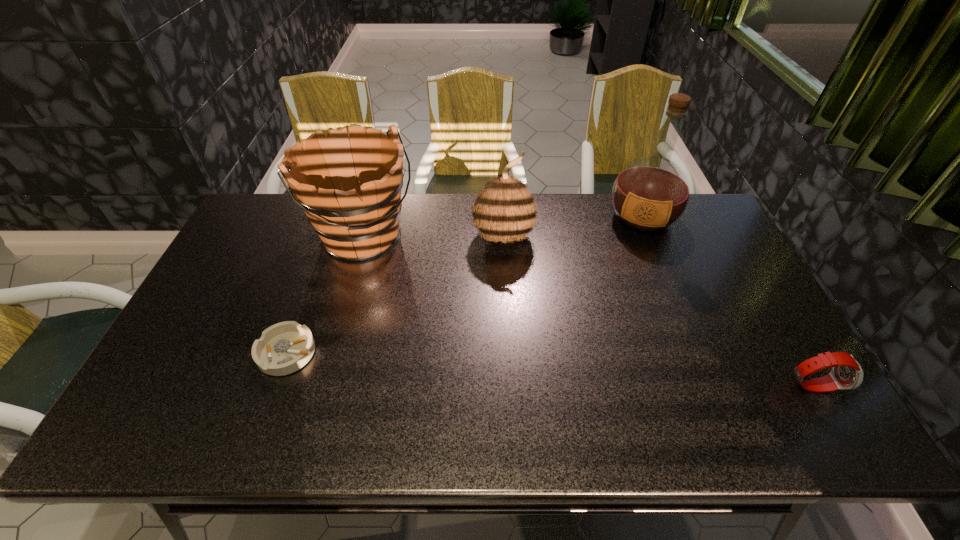
Locate an element on the screen. This screenshot has height=540, width=960. free space at the near left corner of the desktop is located at coordinates (168, 379).

Where is `free space at the far right corner of the desktop`? free space at the far right corner of the desktop is located at coordinates (695, 211).

Where is `free space between the wine bucket and the coconut`? The width and height of the screenshot is (960, 540). free space between the wine bucket and the coconut is located at coordinates (434, 237).

The width and height of the screenshot is (960, 540). Find the location of `vacant area that lies between the wine bucket and the ashtray`. vacant area that lies between the wine bucket and the ashtray is located at coordinates (326, 295).

Where is `vacant area that lies between the ashtray and the rightmost object`? This screenshot has height=540, width=960. vacant area that lies between the ashtray and the rightmost object is located at coordinates click(x=550, y=369).

This screenshot has width=960, height=540. I want to click on vacant space in between the ashtray and the fourth object from left to right, so click(465, 285).

Find the location of a particular element. free space between the third object from left to right and the rightmost object is located at coordinates (658, 310).

Find the location of a particular element. The width and height of the screenshot is (960, 540). unoccupied position between the coconut and the liquor is located at coordinates (572, 227).

The image size is (960, 540). In order to click on free space between the ashtray and the watch in this screenshot , I will do `click(550, 369)`.

I want to click on object that ranks as the fourth closest to the wine bucket, so click(846, 373).